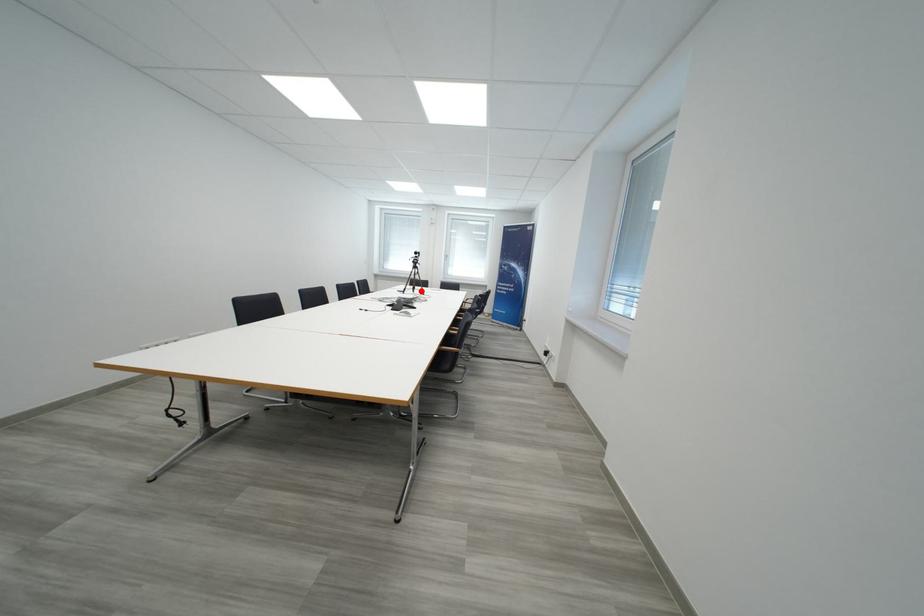
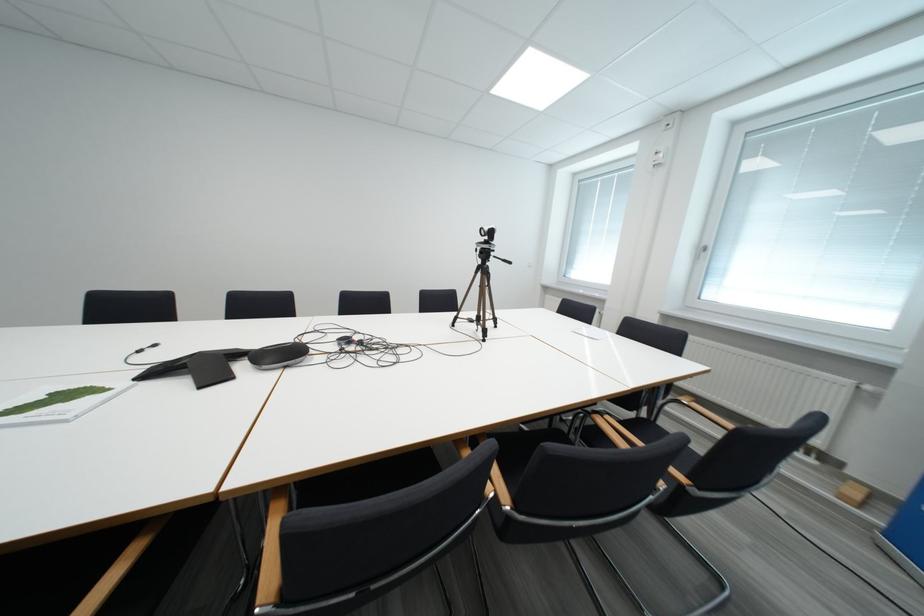
Find the pixel in the second image that matches the highlighted location in the first image.

(485, 322)